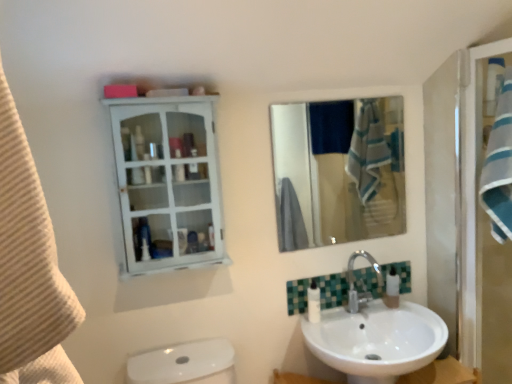
Question: Is white glossy lotion at lower center next to white glossy cabinet at upper left and touching it?

Choices:
 (A) no
 (B) yes

Answer: (A)

Question: From a real-world perspective, is white glossy lotion at lower center positioned under white glossy cabinet at upper left based on gravity?

Choices:
 (A) yes
 (B) no

Answer: (A)

Question: Is white glossy lotion at lower center shorter than white glossy cabinet at upper left?

Choices:
 (A) no
 (B) yes

Answer: (B)

Question: From the image's perspective, is white glossy lotion at lower center above white glossy cabinet at upper left?

Choices:
 (A) no
 (B) yes

Answer: (A)

Question: Can you confirm if white glossy lotion at lower center is positioned to the left of white glossy cabinet at upper left?

Choices:
 (A) no
 (B) yes

Answer: (A)

Question: Considering the relative sizes of white glossy lotion at lower center and white glossy cabinet at upper left in the image provided, is white glossy lotion at lower center taller than white glossy cabinet at upper left?

Choices:
 (A) no
 (B) yes

Answer: (A)

Question: Could you tell me if white glossy lotion at lower center is turned towards beige textured towel at left?

Choices:
 (A) no
 (B) yes

Answer: (A)

Question: Would you say beige textured towel at left is part of white glossy lotion at lower center's contents?

Choices:
 (A) yes
 (B) no

Answer: (B)

Question: Is white glossy lotion at lower center smaller than beige textured towel at left?

Choices:
 (A) yes
 (B) no

Answer: (A)

Question: Can you confirm if white glossy lotion at lower center is positioned to the right of beige textured towel at left?

Choices:
 (A) yes
 (B) no

Answer: (A)

Question: Can you confirm if white glossy lotion at lower center is taller than beige textured towel at left?

Choices:
 (A) yes
 (B) no

Answer: (B)

Question: Is white glossy lotion at lower center not inside beige textured towel at left?

Choices:
 (A) yes
 (B) no

Answer: (A)

Question: Is white glossy cabinet at upper left outside beige textured towel at left?

Choices:
 (A) no
 (B) yes

Answer: (B)